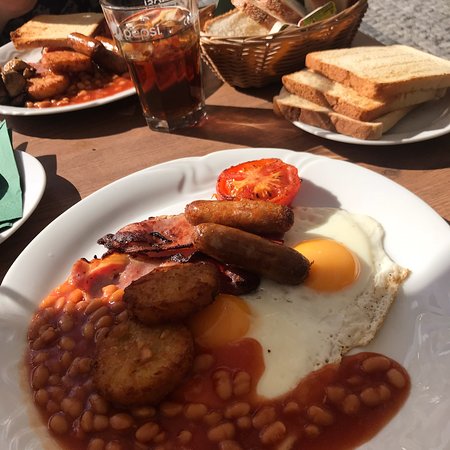
Where is `saucer`? This screenshot has width=450, height=450. saucer is located at coordinates (30, 176).